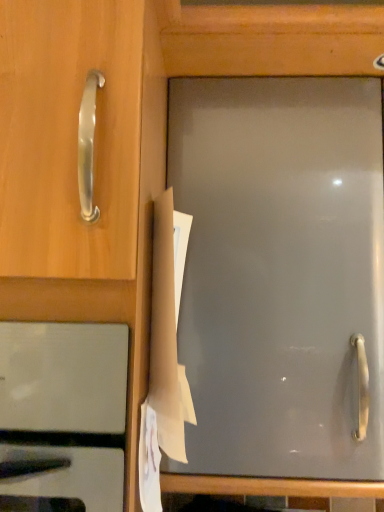
Where is `brown paper at center`? brown paper at center is located at coordinates (165, 355).

What do you see at coordinates (165, 355) in the screenshot?
I see `brown paper at center` at bounding box center [165, 355].

Identify the location of stainless steel oven at lower left. This screenshot has height=512, width=384. (63, 413).

What is the approximate height of stainless steel oven at lower left?

stainless steel oven at lower left is 50.15 centimeters tall.

Describe the element at coordinates (63, 413) in the screenshot. The width and height of the screenshot is (384, 512). I see `stainless steel oven at lower left` at that location.

In order to click on brown paper at center in this screenshot , I will do `click(165, 355)`.

Is brown paper at center at the right side of stainless steel oven at lower left?

Yes.

Which object is more forward, brown paper at center or stainless steel oven at lower left?

stainless steel oven at lower left.

Which is closer, (188, 239) or (87, 428)?

Point (188, 239) is positioned farther from the camera compared to point (87, 428).

From the image's perspective, is brown paper at center on top of stainless steel oven at lower left?

Yes, from the image's perspective, brown paper at center is over stainless steel oven at lower left.

From a real-world perspective, is brown paper at center over stainless steel oven at lower left?

Yes, from a real-world perspective, brown paper at center is above stainless steel oven at lower left.

Between brown paper at center and stainless steel oven at lower left, which one has smaller width?

brown paper at center is thinner.

From the picture: Can you confirm if brown paper at center is shorter than stainless steel oven at lower left?

Correct, brown paper at center is not as tall as stainless steel oven at lower left.

Can you confirm if brown paper at center is bigger than stainless steel oven at lower left?

Actually, brown paper at center might be smaller than stainless steel oven at lower left.

Do you think brown paper at center is within stainless steel oven at lower left, or outside of it?

brown paper at center exists outside the volume of stainless steel oven at lower left.

Is brown paper at center positioned far away from stainless steel oven at lower left?

That's not correct — brown paper at center is a little close to stainless steel oven at lower left.

Is brown paper at center turned away from stainless steel oven at lower left?

Yes, brown paper at center is positioned with its back facing stainless steel oven at lower left.

Where is `oven below the brown paper at center (from the image's perspective)`? Image resolution: width=384 pixels, height=512 pixels. oven below the brown paper at center (from the image's perspective) is located at coordinates (63, 413).

Which object is positioned more to the right, stainless steel oven at lower left or brown paper at center?

From the viewer's perspective, brown paper at center appears more on the right side.

Which object is more forward, stainless steel oven at lower left or brown paper at center?

stainless steel oven at lower left is more forward.

Is point (8, 469) in front of point (158, 310)?

Yes.

In the scene shown: From the image's perspective, is stainless steel oven at lower left located beneath brown paper at center?

Yes, from the image's perspective, stainless steel oven at lower left is beneath brown paper at center.

From a real-world perspective, between stainless steel oven at lower left and brown paper at center, who is vertically higher?

From a 3D spatial view, brown paper at center is above.

Does stainless steel oven at lower left have a greater width compared to brown paper at center?

Indeed, stainless steel oven at lower left has a greater width compared to brown paper at center.

Between stainless steel oven at lower left and brown paper at center, which one has less height?

With less height is brown paper at center.

Which of these two, stainless steel oven at lower left or brown paper at center, is smaller?

brown paper at center is smaller.

Is stainless steel oven at lower left outside of brown paper at center?

stainless steel oven at lower left lies outside brown paper at center's area.

Is stainless steel oven at lower left positioned far away from brown paper at center?

No.

Is stainless steel oven at lower left positioned with its back to brown paper at center?

No, stainless steel oven at lower left is not facing the opposite direction of brown paper at center.

Find the location of `paper that is above the stainless steel oven at lower left (from a real-world perspective)`. paper that is above the stainless steel oven at lower left (from a real-world perspective) is located at coordinates (165, 355).

Locate an element on the screen. This screenshot has width=384, height=512. paper above the stainless steel oven at lower left (from a real-world perspective) is located at coordinates [165, 355].

Locate an element on the screen. oven to the left of brown paper at center is located at coordinates click(x=63, y=413).